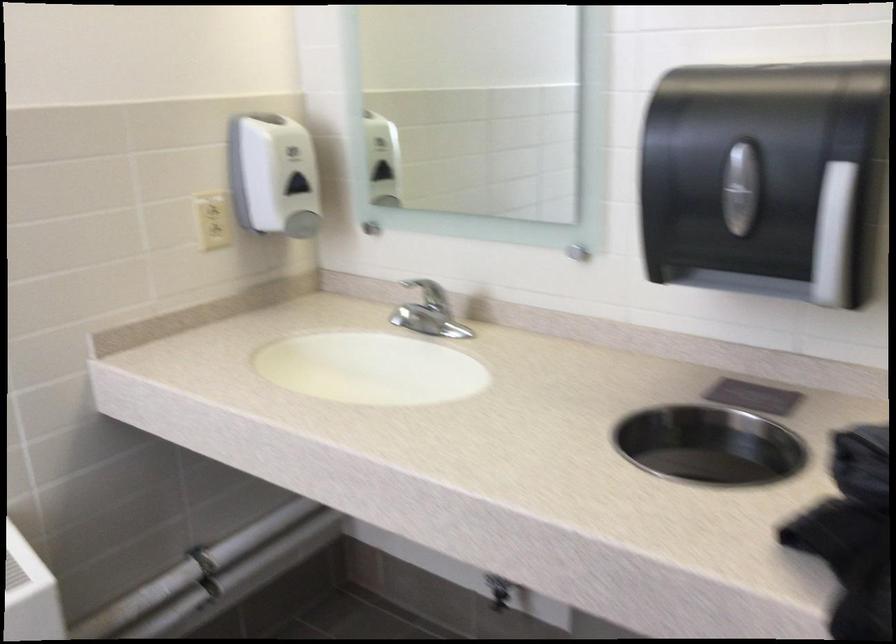
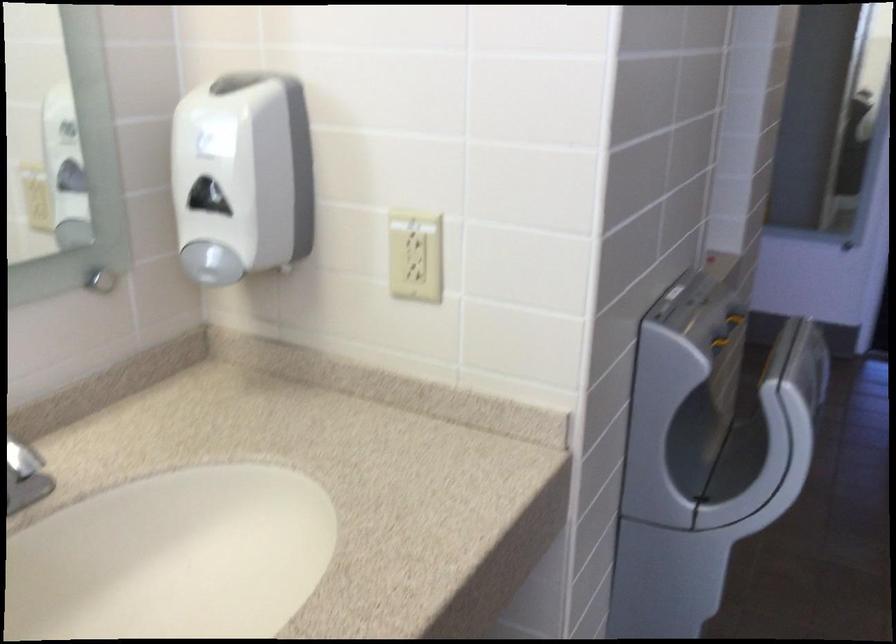
The images are taken continuously from a first-person perspective. In which direction is your viewpoint rotating?

The camera rotated toward right-down.